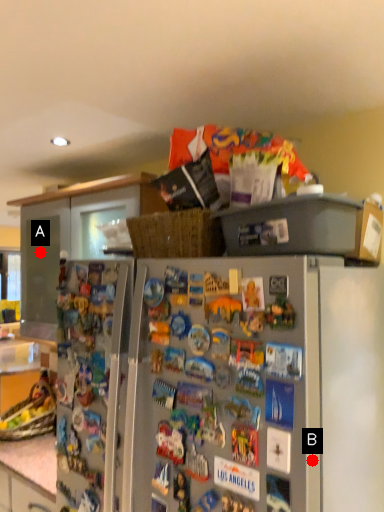
Question: Two points are circled on the image, labeled by A and B beside each circle. Which point appears closest to the camera in this image?

Choices:
 (A) A is closer
 (B) B is closer

Answer: (B)